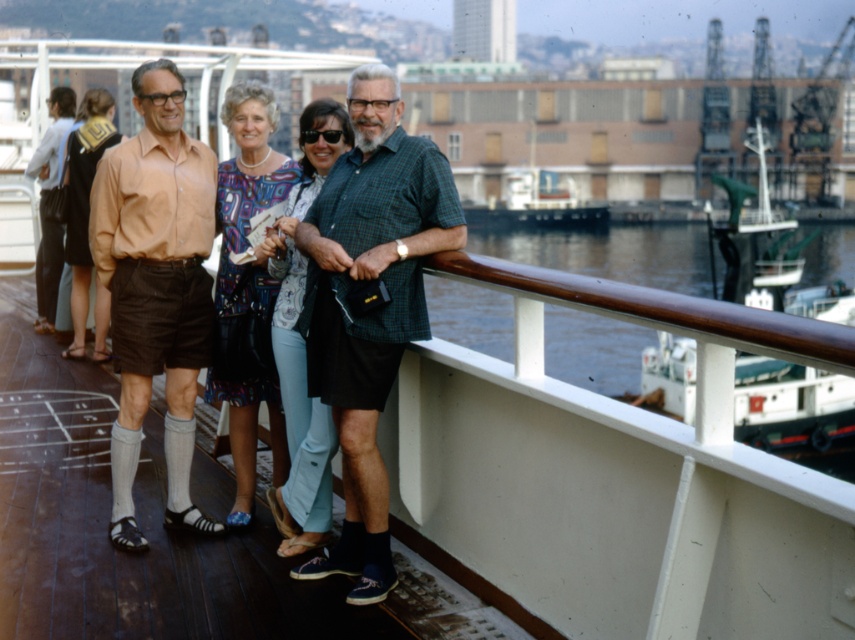
This screenshot has width=855, height=640. Describe the element at coordinates (83, 202) in the screenshot. I see `matte brown dress at left` at that location.

Locate an element on the screen. Image resolution: width=855 pixels, height=640 pixels. matte brown dress at left is located at coordinates (83, 202).

Is point (384, 88) farther from camera compared to point (268, 385)?

No, it is in front of (268, 385).

Who is lower down, green plaid shirt at center or printed silk dress at center?

green plaid shirt at center is below.

The width and height of the screenshot is (855, 640). What do you see at coordinates (369, 304) in the screenshot?
I see `green plaid shirt at center` at bounding box center [369, 304].

The height and width of the screenshot is (640, 855). Find the location of `green plaid shirt at center`. green plaid shirt at center is located at coordinates (369, 304).

How far apart are brown wooden railing at upper right and printed silk dress at center?

A distance of 28.47 meters exists between brown wooden railing at upper right and printed silk dress at center.

Between point (575, 244) and point (270, 426), which one is positioned behind?

Point (575, 244)

Identify the location of brown wooden railing at upper right. (611, 253).

The width and height of the screenshot is (855, 640). Find the location of `brown wooden railing at upper right`. brown wooden railing at upper right is located at coordinates (611, 253).